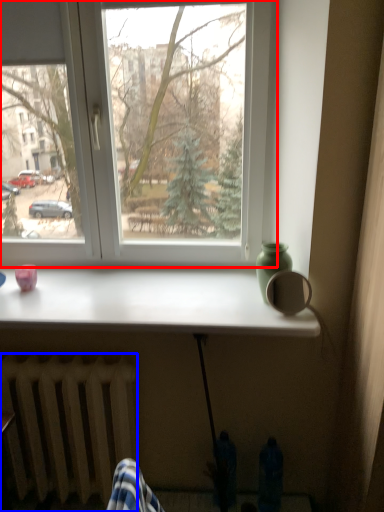
Question: Which of the following is the farthest to the observer, window (highlighted by a red box) or radiator (highlighted by a blue box)?

Choices:
 (A) window
 (B) radiator

Answer: (A)